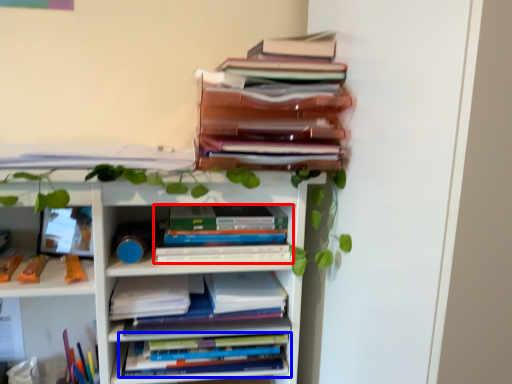
Question: Which object appears closest to the camera in this image, book (highlighted by a red box) or book (highlighted by a blue box)?

Choices:
 (A) book
 (B) book

Answer: (A)